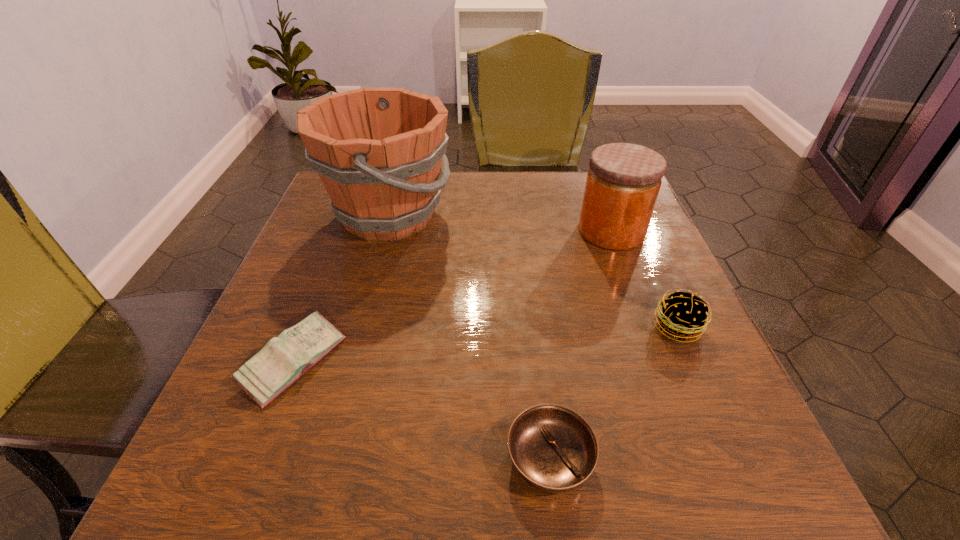
The image size is (960, 540). I want to click on vacant area located 0.210m on the right of the shortest object, so click(x=746, y=458).

Locate an element on the screen. bucket that is at the far edge is located at coordinates (378, 151).

In order to click on jar that is at the far edge in this screenshot , I will do point(623,182).

I want to click on object situated at the near edge, so click(x=554, y=449).

Where is `bucket located at the left edge`? This screenshot has height=540, width=960. bucket located at the left edge is located at coordinates (378, 151).

What are the coordinates of `diary that is at the left edge` in the screenshot? It's located at (284, 359).

You are a GUI agent. You are given a task and a screenshot of the screen. Output one action in this format:
    pyautogui.click(x=<x>, y=<y>)
    Task: Click on the jar at the right edge
    This screenshot has height=540, width=960.
    Given the screenshot: What is the action you would take?
    pyautogui.click(x=623, y=182)

Find the location of a particular element. patty at the right edge is located at coordinates (683, 315).

Identify the location of object present at the far left corner. The height and width of the screenshot is (540, 960). coord(378,151).

Locate an element on the screen. The width and height of the screenshot is (960, 540). object located in the far right corner section of the desktop is located at coordinates (623, 182).